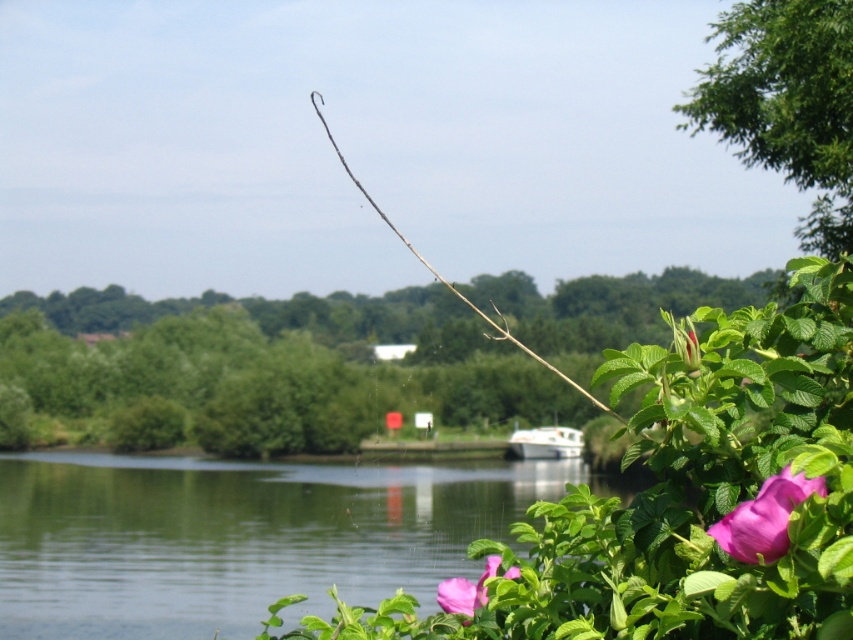
Can you confirm if green smooth water at center is positioned to the left of green leafy tree at upper right?

Correct, you'll find green smooth water at center to the left of green leafy tree at upper right.

Does green smooth water at center appear over green leafy tree at upper right?

Incorrect, green smooth water at center is not positioned above green leafy tree at upper right.

Which is in front, point (302, 472) or point (746, 124)?

Positioned in front is point (746, 124).

Identify the location of green smooth water at center. The width and height of the screenshot is (853, 640). (241, 536).

Looking at this image, does green leafy tree at upper right lie in front of pink matte flower at lower center?

No.

Is green leafy tree at upper right bigger than pink matte flower at lower center?

Correct, green leafy tree at upper right is larger in size than pink matte flower at lower center.

Find the location of `green leafy tree at upper right`. green leafy tree at upper right is located at coordinates (786, 104).

Can you confirm if pink matte flower at lower right is positioned to the left of pink matte flower at lower center?

No, pink matte flower at lower right is not to the left of pink matte flower at lower center.

Can you confirm if pink matte flower at lower right is wider than pink matte flower at lower center?

No.

What do you see at coordinates (764, 516) in the screenshot? I see `pink matte flower at lower right` at bounding box center [764, 516].

This screenshot has height=640, width=853. What are the coordinates of `pink matte flower at lower right` in the screenshot? It's located at (764, 516).